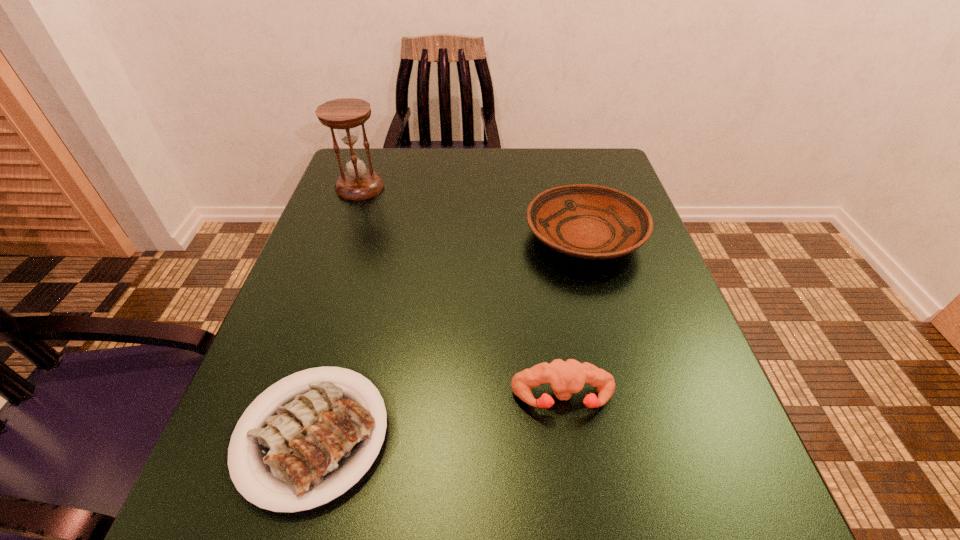
Locate an element on the screen. the tallest object is located at coordinates (345, 115).

This screenshot has width=960, height=540. In order to click on hourglass in this screenshot , I will do `click(345, 115)`.

This screenshot has height=540, width=960. What are the coordinates of `puncher` in the screenshot? It's located at (566, 377).

Find the location of a particular element. This screenshot has height=540, width=960. the third nearest object is located at coordinates (586, 221).

The height and width of the screenshot is (540, 960). What are the coordinates of `the farther plate` in the screenshot? It's located at (586, 221).

Locate an element on the screen. This screenshot has width=960, height=540. the left plate is located at coordinates (309, 444).

Where is `the shorter plate`? This screenshot has height=540, width=960. the shorter plate is located at coordinates (309, 444).

This screenshot has width=960, height=540. I want to click on vacant space located on the back of the farthest object, so click(x=372, y=155).

At what (x,y) coordinates should I click in order to perform the action: click on free space located with the gloves of the puncher facing forward. Please return your answer as a coordinate pair (x, y). This screenshot has width=960, height=540. Looking at the image, I should click on (576, 483).

The width and height of the screenshot is (960, 540). What are the coordinates of `free space located on the back of the right plate` in the screenshot? It's located at (569, 180).